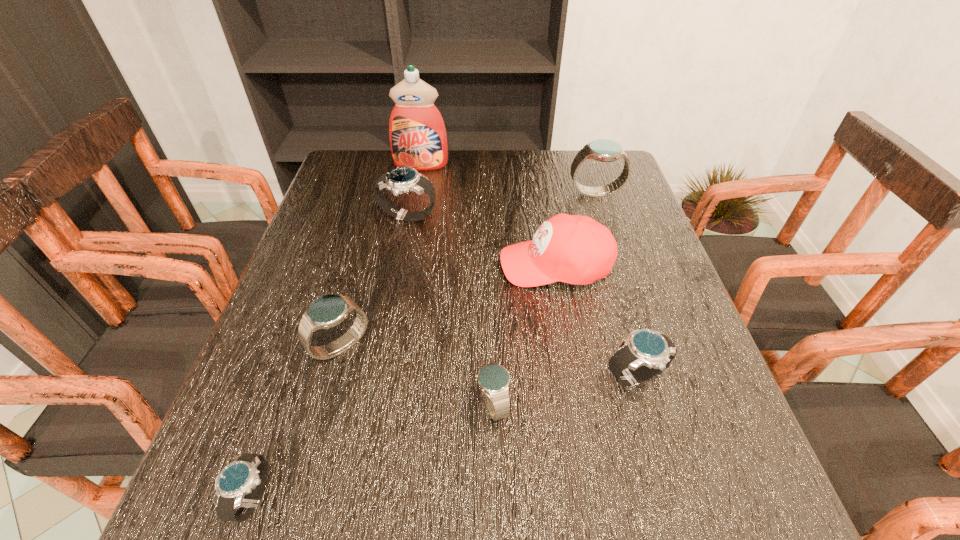
Image resolution: width=960 pixels, height=540 pixels. What are the coordinates of `the second nearest silver watch` in the screenshot? It's located at (646, 353).

This screenshot has height=540, width=960. What are the coordinates of `the second blue watch from right to left` in the screenshot? It's located at (493, 379).

You are a GUI agent. You are given a task and a screenshot of the screen. Output one action in this format:
    pyautogui.click(x=<x>, y=<y>)
    Task: Click on the fourth watch from left to right
    
    Given the screenshot: What is the action you would take?
    pyautogui.click(x=493, y=379)

Locate an element on the screen. The image size is (960, 540). the nearest silver watch is located at coordinates (246, 474).

Where is `the smallest silver watch`? This screenshot has height=540, width=960. the smallest silver watch is located at coordinates (246, 474).

You are a GUI agent. You are given a task and a screenshot of the screen. Output one action in this format:
    pyautogui.click(x=<x>, y=<y>)
    Task: Click on the vacant space situated 0.080m on the front surface of the detergent
    
    Given the screenshot: What is the action you would take?
    pyautogui.click(x=417, y=187)

At what (x,y) coordinates should I click in order to perform the action: click on free space located on the left of the seventh nearest object. Please return your answer as a coordinate pair (x, y). The image size is (960, 540). Looking at the image, I should click on (478, 193).

Locate an element on the screen. Image resolution: width=960 pixels, height=540 pixels. free location located 0.050m on the front of the farthest silver watch is located at coordinates (403, 242).

You are a GUI agent. You are given a task and a screenshot of the screen. Output one action in this format:
    pyautogui.click(x=<x>, y=<y>)
    Task: Click on the blank space located on the front panel of the baseball cap
    
    Given the screenshot: What is the action you would take?
    pyautogui.click(x=352, y=265)

In order to click on free space located on the front panel of the baseball cap in this screenshot , I will do `click(400, 265)`.